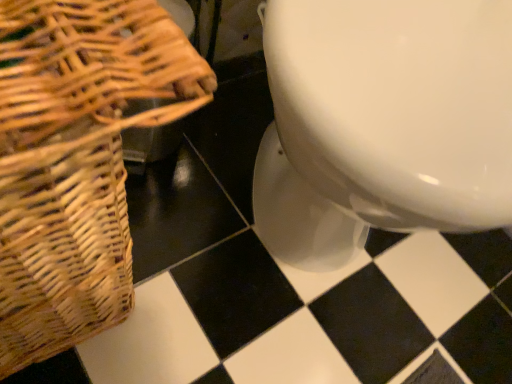
Measure the distance between white glossy toilet at center and camera.

A distance of 12.90 inches exists between white glossy toilet at center and camera.

Where is `white glossy toilet at center`? This screenshot has width=512, height=384. white glossy toilet at center is located at coordinates (382, 123).

This screenshot has width=512, height=384. What do you see at coordinates (382, 123) in the screenshot?
I see `white glossy toilet at center` at bounding box center [382, 123].

Image resolution: width=512 pixels, height=384 pixels. I want to click on woven brown picnic basket at left, so 76,160.

This screenshot has height=384, width=512. What do you see at coordinates (76, 160) in the screenshot?
I see `woven brown picnic basket at left` at bounding box center [76, 160].

Image resolution: width=512 pixels, height=384 pixels. I want to click on white glossy toilet at center, so click(x=382, y=123).

Which object is positioned more to the left, woven brown picnic basket at left or white glossy toilet at center?

Positioned to the left is woven brown picnic basket at left.

Is the position of woven brown picnic basket at left more distant than that of white glossy toilet at center?

No, woven brown picnic basket at left is closer to the viewer.

Considering the positions of point (152, 28) and point (273, 64), is point (152, 28) closer or farther from the camera than point (273, 64)?

Point (152, 28) is closer to the camera than point (273, 64).

From the image's perspective, is woven brown picnic basket at left above white glossy toilet at center?

Actually, woven brown picnic basket at left appears below white glossy toilet at center in the image.

From a real-world perspective, who is located higher, woven brown picnic basket at left or white glossy toilet at center?

From a 3D spatial view, white glossy toilet at center is above.

Is woven brown picnic basket at left thinner than white glossy toilet at center?

Indeed, woven brown picnic basket at left has a lesser width compared to white glossy toilet at center.

Considering the relative sizes of woven brown picnic basket at left and white glossy toilet at center in the image provided, is woven brown picnic basket at left shorter than white glossy toilet at center?

Correct, woven brown picnic basket at left is not as tall as white glossy toilet at center.

Who is smaller, woven brown picnic basket at left or white glossy toilet at center?

Smaller between the two is woven brown picnic basket at left.

Is woven brown picnic basket at left situated inside white glossy toilet at center or outside?

woven brown picnic basket at left is outside white glossy toilet at center.

Would you consider woven brown picnic basket at left to be distant from white glossy toilet at center?

woven brown picnic basket at left is actually quite close to white glossy toilet at center.

Is woven brown picnic basket at left oriented towards white glossy toilet at center?

No.

How different are the orientations of woven brown picnic basket at left and white glossy toilet at center in degrees?

The angular difference between woven brown picnic basket at left and white glossy toilet at center is 41.5 degrees.

Find the location of a particular element. The image size is (512, 384). toilet above the woven brown picnic basket at left (from the image's perspective) is located at coordinates (382, 123).

Which object is positioned more to the right, white glossy toilet at center or woven brown picnic basket at left?

From the viewer's perspective, white glossy toilet at center appears more on the right side.

Does white glossy toilet at center lie in front of woven brown picnic basket at left?

No, it is behind woven brown picnic basket at left.

Considering the positions of point (367, 230) and point (142, 115), is point (367, 230) closer or farther from the camera than point (142, 115)?

Point (367, 230).

From the image's perspective, is white glossy toilet at center located beneath woven brown picnic basket at left?

No, from the image's perspective, white glossy toilet at center is not below woven brown picnic basket at left.

From a real-world perspective, relative to woven brown picnic basket at left, is white glossy toilet at center vertically above or below?

white glossy toilet at center is above woven brown picnic basket at left.

Considering the relative sizes of white glossy toilet at center and woven brown picnic basket at left in the image provided, is white glossy toilet at center thinner than woven brown picnic basket at left?

Incorrect, the width of white glossy toilet at center is not less than that of woven brown picnic basket at left.

Who is shorter, white glossy toilet at center or woven brown picnic basket at left?

woven brown picnic basket at left is shorter.

Considering the relative sizes of white glossy toilet at center and woven brown picnic basket at left in the image provided, is white glossy toilet at center bigger than woven brown picnic basket at left?

Yes.

Is white glossy toilet at center spatially inside woven brown picnic basket at left, or outside of it?

The correct answer is: outside.

Are white glossy toilet at center and woven brown picnic basket at left making contact?

No, white glossy toilet at center is not in contact with woven brown picnic basket at left.

Is white glossy toilet at center facing towards woven brown picnic basket at left?

No, white glossy toilet at center is not aimed at woven brown picnic basket at left.

In the image, there is a woven brown picnic basket at left. Identify the location of toilet above it (from the image's perspective). The height and width of the screenshot is (384, 512). (382, 123).

The width and height of the screenshot is (512, 384). I want to click on picnic basket that is on the left side of white glossy toilet at center, so click(x=76, y=160).

Where is `picnic basket that is below the white glossy toilet at center (from the image's perspective)`? Image resolution: width=512 pixels, height=384 pixels. picnic basket that is below the white glossy toilet at center (from the image's perspective) is located at coordinates (76, 160).